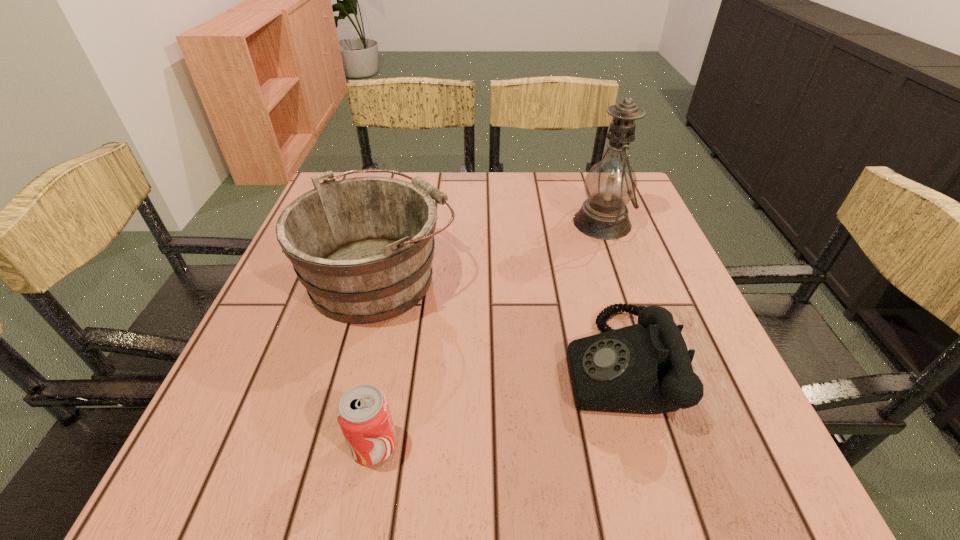
Select which object is the second closest to the oil lamp. Please provide its 2D coordinates. Your answer should be formatted as a tuple, i.e. [(x, y)], where the tuple contains the x and y coordinates of a point satisfying the conditions above.

[(362, 247)]

This screenshot has height=540, width=960. I want to click on the second closest object to the telephone, so pos(362,247).

Identify the location of free space that satisfies the following two spatial constraints: 1. on the dial of the telephone; 2. on the front side of the soda can. This screenshot has width=960, height=540. (638, 444).

This screenshot has width=960, height=540. In order to click on vacant position in the image that satisfies the following two spatial constraints: 1. on the back side of the soda can; 2. on the right side of the tallest object in this screenshot , I will do `click(416, 222)`.

Find the location of `vacant position in the image that satisfies the following two spatial constraints: 1. on the front side of the tallest object; 2. on the dial of the telephone`. vacant position in the image that satisfies the following two spatial constraints: 1. on the front side of the tallest object; 2. on the dial of the telephone is located at coordinates (652, 363).